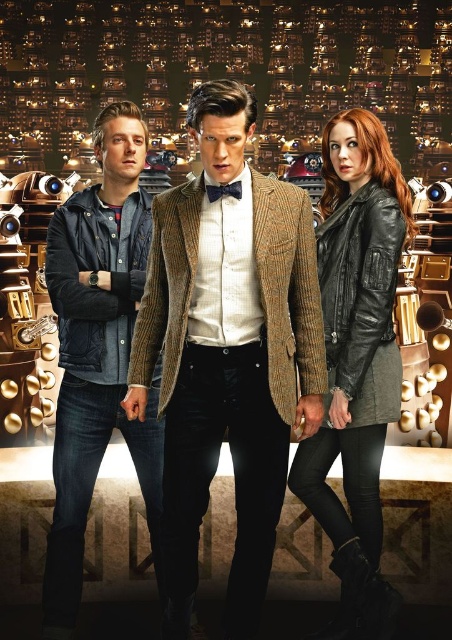
Question: Observing the image, what is the correct spatial positioning of brown woolen blazer at center in reference to denim jacket at left?

Choices:
 (A) above
 (B) below

Answer: (B)

Question: Is brown woolen blazer at center above black leather jacket at right?

Choices:
 (A) yes
 (B) no

Answer: (A)

Question: Which object is positioned farthest from the black leather jacket at right?

Choices:
 (A) denim jacket at left
 (B) brown woolen blazer at center

Answer: (A)

Question: Which point is farther to the camera?

Choices:
 (A) (390, 300)
 (B) (99, 342)

Answer: (B)

Question: Which object is closer to the camera taking this photo?

Choices:
 (A) black leather jacket at right
 (B) brown woolen blazer at center

Answer: (B)

Question: Can you confirm if brown woolen blazer at center is smaller than denim jacket at left?

Choices:
 (A) yes
 (B) no

Answer: (A)